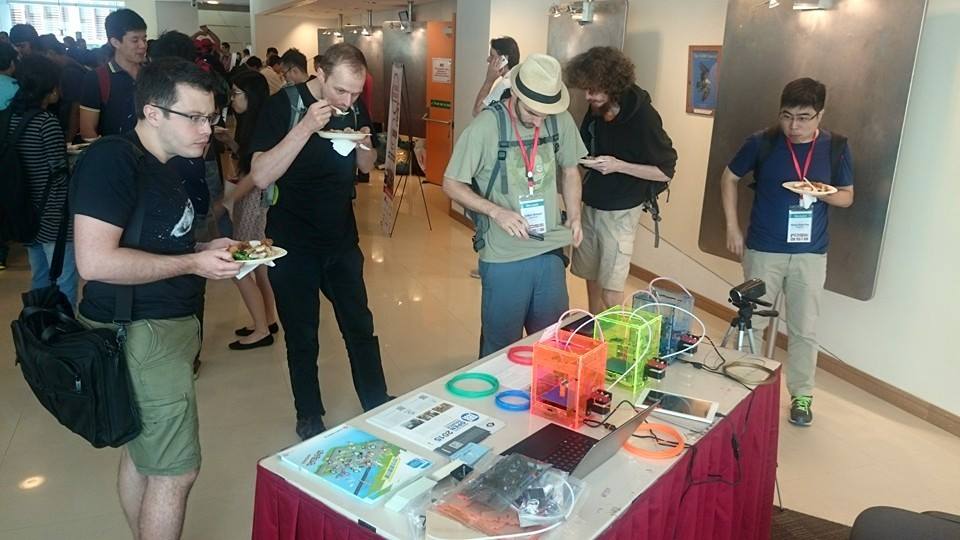
The image size is (960, 540). Find the location of `shiny floor`. shiny floor is located at coordinates (212, 507), (258, 377), (12, 448), (420, 328), (432, 246), (408, 226), (906, 461), (817, 452), (367, 202).